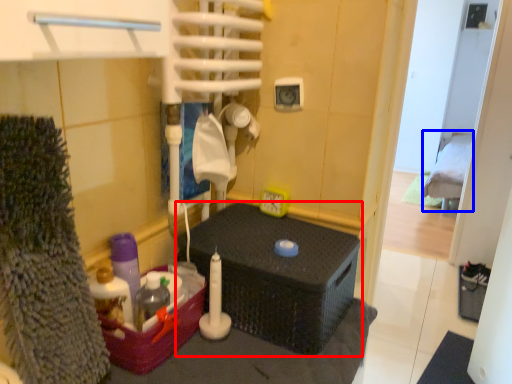
Question: Which object appears farthest to the camera in this image, furniture (highlighted by a red box) or bed (highlighted by a blue box)?

Choices:
 (A) furniture
 (B) bed

Answer: (B)